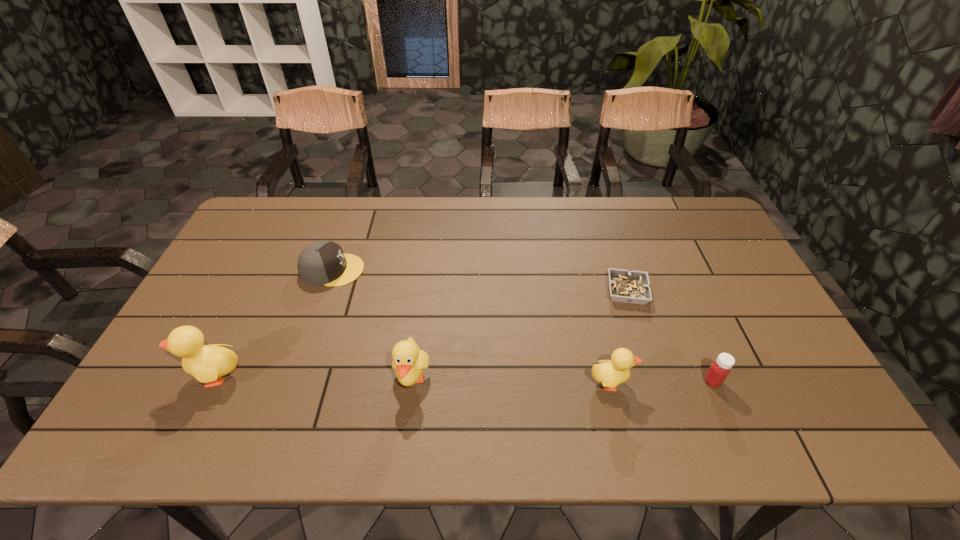
Identify the location of blank area at the far right corner. (668, 220).

Locate an element on the screen. This screenshot has height=540, width=960. empty location between the second object from left to right and the rightmost object is located at coordinates (522, 326).

The image size is (960, 540). I want to click on free area in between the rightmost duckling and the rightmost object, so click(x=661, y=382).

This screenshot has width=960, height=540. What are the coordinates of `empty space that is in between the third tallest object and the second tallest object` in the screenshot? It's located at (511, 380).

You are a GUI agent. You are given a task and a screenshot of the screen. Output one action in this format:
    pyautogui.click(x=<x>, y=<y>)
    Task: Click on the free space between the cap and the leftmost object
    This screenshot has width=960, height=540.
    Given the screenshot: What is the action you would take?
    pyautogui.click(x=275, y=322)

The width and height of the screenshot is (960, 540). I want to click on vacant area between the shortest duckling and the third object from left to right, so click(x=511, y=380).

Where is `free space between the rightmost duckling and the third object from left to right`? This screenshot has width=960, height=540. free space between the rightmost duckling and the third object from left to right is located at coordinates (511, 380).

Image resolution: width=960 pixels, height=540 pixels. Identify the location of blank region between the shortest duckling and the cap. (471, 326).

The image size is (960, 540). Find the location of `free space that is in between the medicine and the ashtray`. free space that is in between the medicine and the ashtray is located at coordinates (669, 336).

This screenshot has height=540, width=960. What are the coordinates of `empty space between the rightmost object and the shortest object` in the screenshot? It's located at (669, 336).